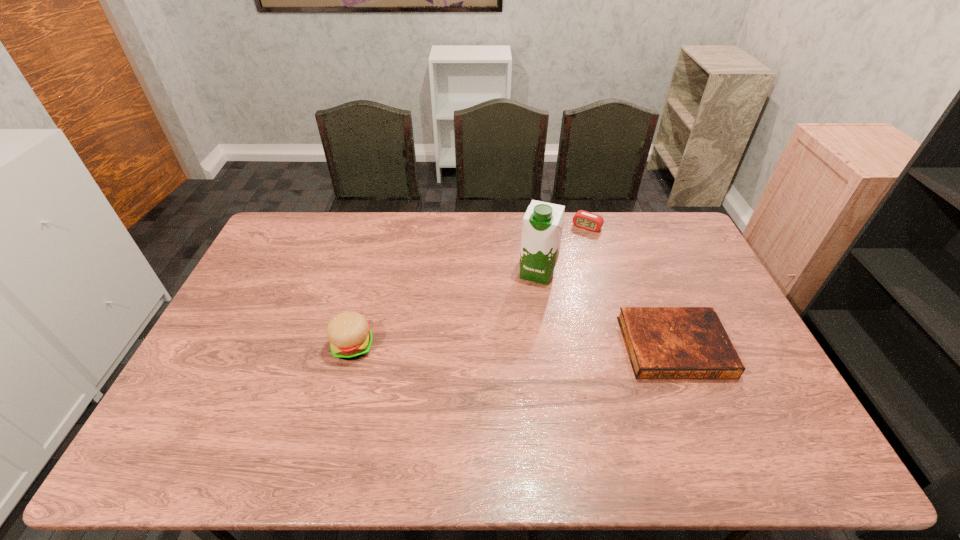
At what (x,y) coordinates should I click in order to perform the action: click on the leftmost object. Please return your answer as a coordinate pair (x, y). Looking at the image, I should click on (349, 333).

This screenshot has width=960, height=540. I want to click on hamburger, so click(x=349, y=333).

You are a GUI agent. You are given a task and a screenshot of the screen. Output one action in this format:
    pyautogui.click(x=<x>, y=<y>)
    Task: Click on the shortest object
    
    Given the screenshot: What is the action you would take?
    pyautogui.click(x=662, y=342)

The width and height of the screenshot is (960, 540). I want to click on alarm clock, so click(x=583, y=219).

Where is `soya milk`? The height and width of the screenshot is (540, 960). soya milk is located at coordinates (543, 222).

Find the location of a particular element. This screenshot has width=960, height=540. the second farthest object is located at coordinates (543, 222).

The image size is (960, 540). Find the location of `vacant region located 0.190m on the left of the leftmost object`. vacant region located 0.190m on the left of the leftmost object is located at coordinates (267, 347).

Locate an element on the screen. The height and width of the screenshot is (540, 960). vacant region located on the spine side of the shortest object is located at coordinates (704, 421).

At what (x,y) coordinates should I click in order to perform the action: click on vacant area situated 0.160m on the front-facing side of the alarm clock. Please return your answer as a coordinate pair (x, y). Looking at the image, I should click on (566, 256).

Image resolution: width=960 pixels, height=540 pixels. Find the location of `blank space located 0.100m on the front-facing side of the alarm clock`. blank space located 0.100m on the front-facing side of the alarm clock is located at coordinates (572, 247).